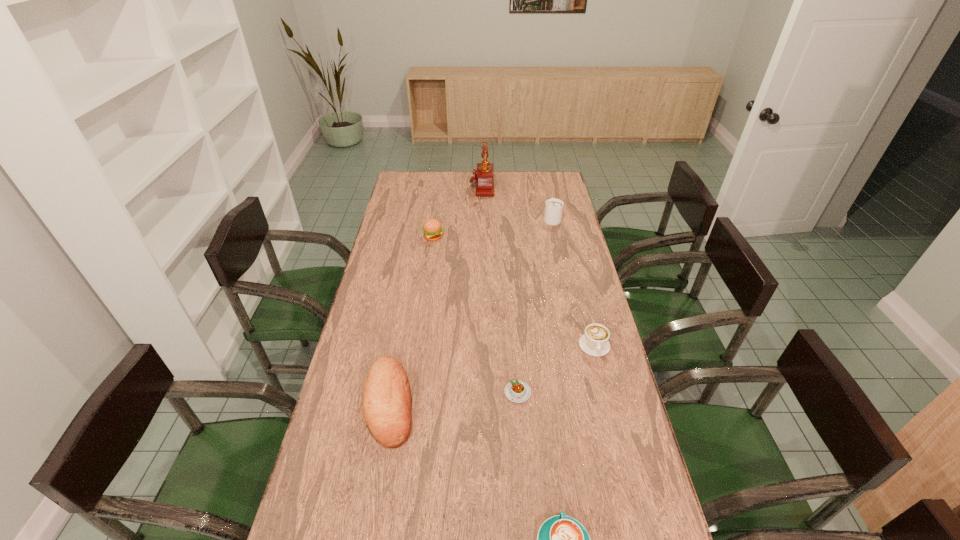
Select which object appears as the third closest to the second nearest cappuccino. Please provide its 2D coordinates. Your answer should be formatted as a tuple, i.e. [(x, y)], where the tuple contains the x and y coordinates of a point satisfying the conditions above.

[(387, 404)]

Find the location of a particular element. object that is the third closest one to the fifth object from right to left is located at coordinates (594, 342).

This screenshot has height=540, width=960. What are the coordinates of `the second closest cappuccino to the second farthest cappuccino` in the screenshot? It's located at (554, 207).

Locate which cappuccino ranks in proximity to the farthest cappuccino. Please provide its 2D coordinates. Your answer should be formatted as a tuple, i.e. [(x, y)], where the tuple contains the x and y coordinates of a point satisfying the conditions above.

[(594, 342)]

I want to click on vacant space that satisfies the following two spatial constraints: 1. on the dial of the farthest object; 2. on the front side of the fifth nearest object, so click(x=482, y=238).

Find the location of a particular element. This screenshot has height=540, width=960. free region that satisfies the following two spatial constraints: 1. on the dial of the farthest object; 2. on the front side of the bread is located at coordinates (483, 403).

The height and width of the screenshot is (540, 960). In order to click on free location that satisfies the following two spatial constraints: 1. on the dial of the farthest object; 2. on the front side of the fifth nearest object in this screenshot , I will do pos(482,238).

Where is `free region that satisfies the following two spatial constraints: 1. on the dial of the third object from left to right; 2. on the front side of the bread`? Image resolution: width=960 pixels, height=540 pixels. free region that satisfies the following two spatial constraints: 1. on the dial of the third object from left to right; 2. on the front side of the bread is located at coordinates tap(483, 403).